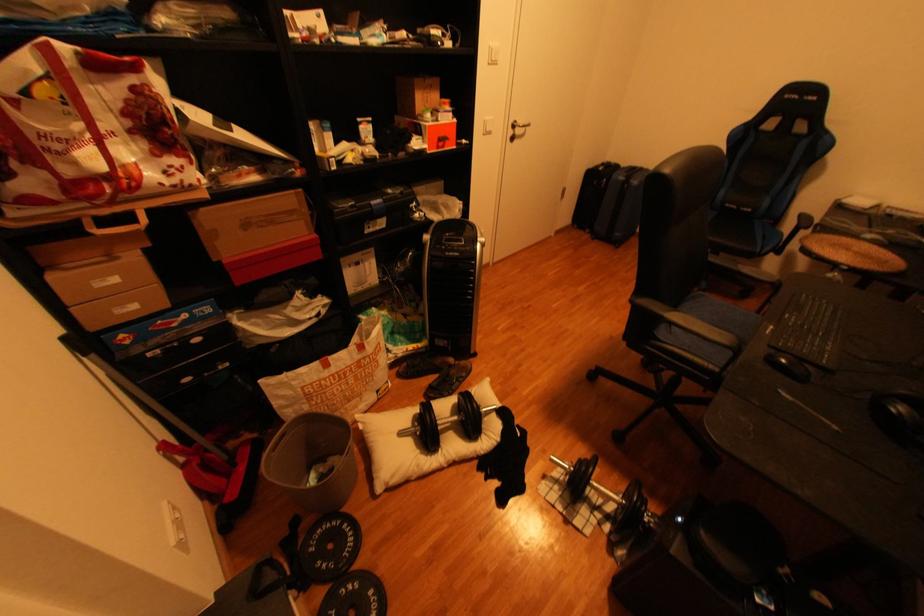
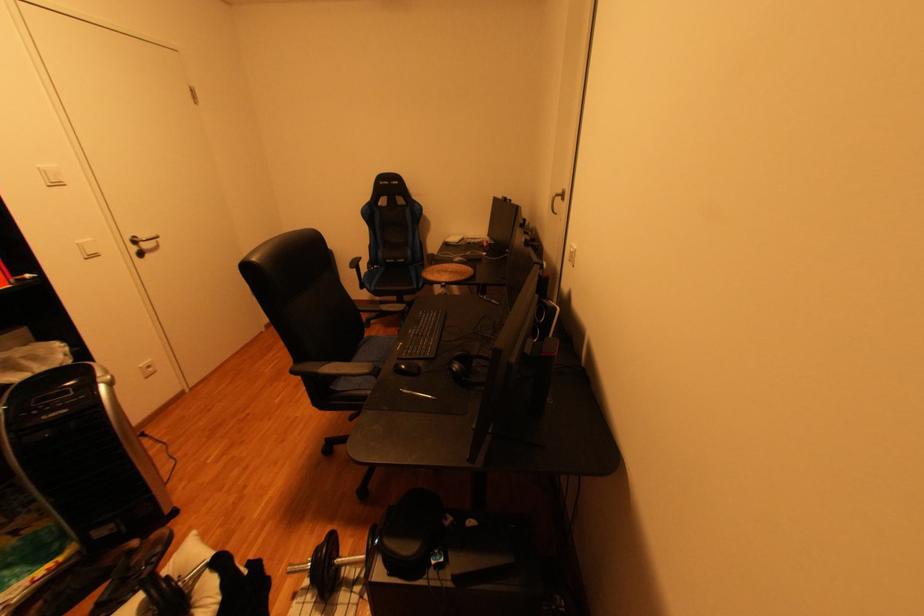
Locate, in the second image, the point that corresponds to the point at 569,495 in the first image.

(323, 600)